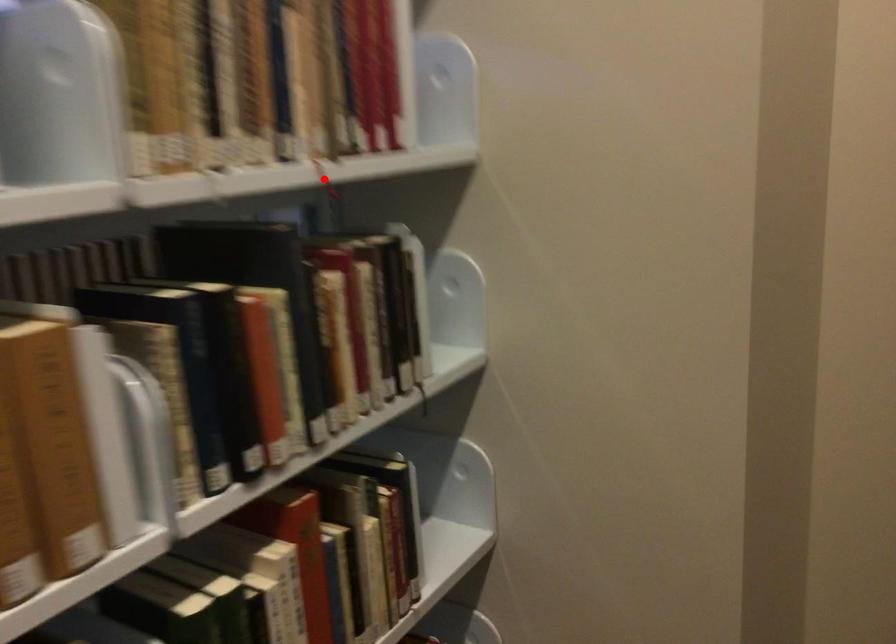
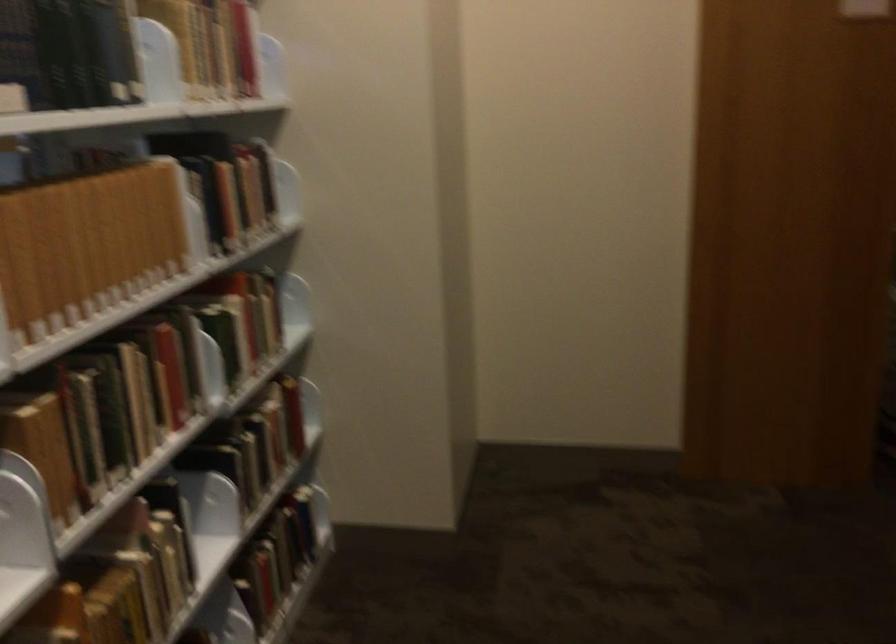
Question: I am providing you with two images of the same scene from different viewpoints. A red point is marked on the first image. At the location where the point appears in image 1, is it still visible in image 2?

Choices:
 (A) Yes
 (B) No

Answer: (B)